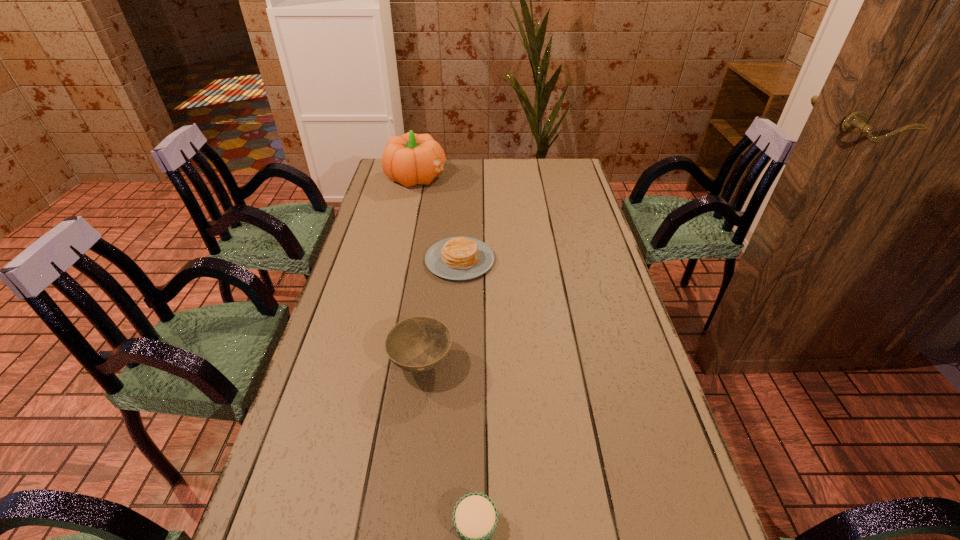
The image size is (960, 540). Identify the location of object that is the second closest to the pumpkin. pyautogui.click(x=417, y=344).

This screenshot has width=960, height=540. Find the location of `free space that satisfies the following two spatial constraints: 1. on the back side of the second tallest object; 2. on the right side of the pancake`. free space that satisfies the following two spatial constraints: 1. on the back side of the second tallest object; 2. on the right side of the pancake is located at coordinates (434, 260).

Image resolution: width=960 pixels, height=540 pixels. Find the location of `blank space that satisfies the following two spatial constraints: 1. on the carved face of the third shortest object; 2. on the right side of the farthest object`. blank space that satisfies the following two spatial constraints: 1. on the carved face of the third shortest object; 2. on the right side of the farthest object is located at coordinates (375, 363).

This screenshot has height=540, width=960. Find the location of `free spot that satisfies the following two spatial constraints: 1. on the carved face of the third shortest object; 2. on the right side of the pumpkin`. free spot that satisfies the following two spatial constraints: 1. on the carved face of the third shortest object; 2. on the right side of the pumpkin is located at coordinates (375, 363).

The height and width of the screenshot is (540, 960). What are the coordinates of `vacant space that satisfies the following two spatial constraints: 1. on the carved face of the pumpkin; 2. on the right side of the second shortest object` in the screenshot? It's located at (398, 260).

I want to click on free space that satisfies the following two spatial constraints: 1. on the carved face of the farthest object; 2. on the right side of the third tallest object, so click(x=398, y=260).

Locate an element on the screen. The height and width of the screenshot is (540, 960). vacant point that satisfies the following two spatial constraints: 1. on the carved face of the tallest object; 2. on the right side of the pancake is located at coordinates (398, 260).